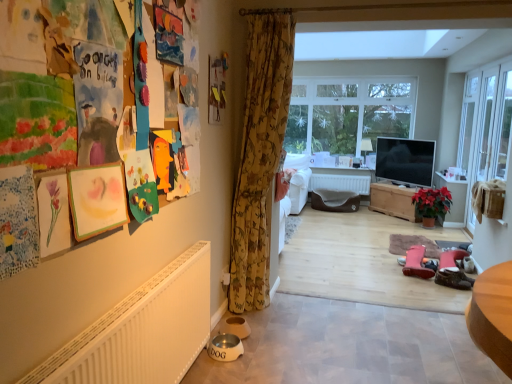
Question: Is there a large distance between clear glass window at center and wooden chest at center?

Choices:
 (A) yes
 (B) no

Answer: (A)

Question: From the image's perspective, is clear glass window at center below wooden chest at center?

Choices:
 (A) no
 (B) yes

Answer: (A)

Question: Is clear glass window at center closer to the viewer compared to wooden chest at center?

Choices:
 (A) yes
 (B) no

Answer: (B)

Question: Considering the relative positions of clear glass window at center and wooden chest at center in the image provided, is clear glass window at center behind wooden chest at center?

Choices:
 (A) no
 (B) yes

Answer: (B)

Question: Is clear glass window at center taller than wooden chest at center?

Choices:
 (A) yes
 (B) no

Answer: (A)

Question: Does clear glass window at center have a larger size compared to wooden chest at center?

Choices:
 (A) yes
 (B) no

Answer: (B)

Question: From the image's perspective, is green matte poinsettia at center-right on clear glass window at center?

Choices:
 (A) no
 (B) yes

Answer: (A)

Question: Is green matte poinsettia at center-right next to clear glass window at center?

Choices:
 (A) no
 (B) yes

Answer: (A)

Question: Can you confirm if green matte poinsettia at center-right is taller than clear glass window at center?

Choices:
 (A) yes
 (B) no

Answer: (B)

Question: Considering the relative positions of green matte poinsettia at center-right and clear glass window at center in the image provided, is green matte poinsettia at center-right behind clear glass window at center?

Choices:
 (A) no
 (B) yes

Answer: (A)

Question: Can you confirm if green matte poinsettia at center-right is shorter than clear glass window at center?

Choices:
 (A) no
 (B) yes

Answer: (B)

Question: Are green matte poinsettia at center-right and clear glass window at center far apart?

Choices:
 (A) yes
 (B) no

Answer: (A)

Question: Is wooden chest at center thinner than green matte poinsettia at center-right?

Choices:
 (A) yes
 (B) no

Answer: (B)